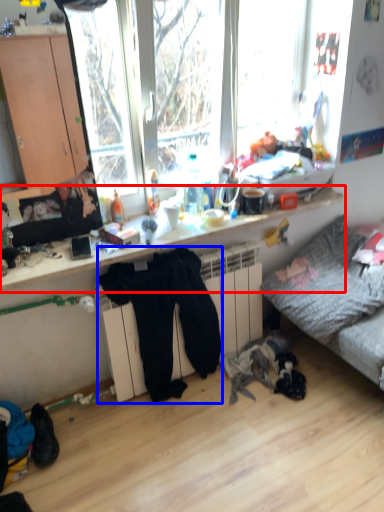
Question: Which object appears farthest to the camera in this image, desk (highlighted by a red box) or clothing (highlighted by a blue box)?

Choices:
 (A) desk
 (B) clothing

Answer: (B)